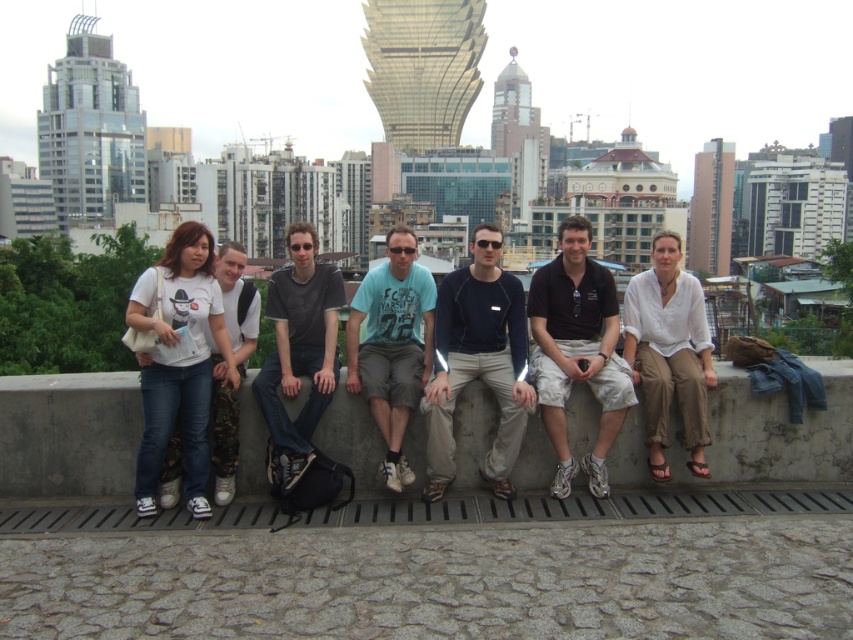
Question: Which is nearer to the dark blue fleece at center?

Choices:
 (A) light blue t-shirt at center
 (B) dark gray t-shirt at center
 (C) camo fabric pants at left
 (D) dark brown leather shorts at center

Answer: (A)

Question: Estimate the real-world distances between objects in this image. Which object is closer to the camo fabric pants at left?

Choices:
 (A) light blue t-shirt at center
 (B) dark gray t-shirt at center

Answer: (B)

Question: Which object is the closest to the dark brown leather shorts at center?

Choices:
 (A) camo fabric pants at left
 (B) light blue t-shirt at center
 (C) dark gray t-shirt at center
 (D) dark blue fleece at center

Answer: (D)

Question: In this image, where is dark brown leather shorts at center located relative to dark gray t-shirt at center?

Choices:
 (A) above
 (B) below

Answer: (A)

Question: Does light blue t-shirt at center lie behind camo fabric pants at left?

Choices:
 (A) no
 (B) yes

Answer: (B)

Question: Is dark blue fleece at center closer to camera compared to dark brown leather shorts at center?

Choices:
 (A) yes
 (B) no

Answer: (B)